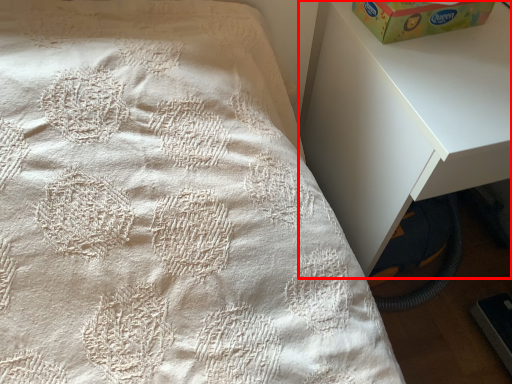
Question: From the image's perspective, what is the correct spatial relationship of nightstand (annotated by the red box) in relation to box?

Choices:
 (A) above
 (B) below

Answer: (B)